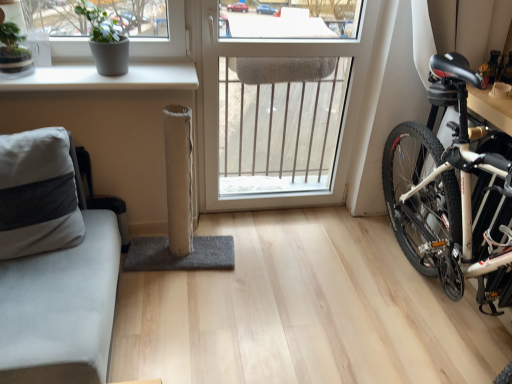
Question: Is gray matte pot at upper left smaller than white plastic window at center?

Choices:
 (A) yes
 (B) no

Answer: (A)

Question: From the image's perspective, is gray matte pot at upper left over white plastic window at center?

Choices:
 (A) no
 (B) yes

Answer: (B)

Question: Is gray matte pot at upper left in contact with white plastic window at center?

Choices:
 (A) yes
 (B) no

Answer: (B)

Question: Is gray matte pot at upper left at the right side of white plastic window at center?

Choices:
 (A) no
 (B) yes

Answer: (A)

Question: Does gray matte pot at upper left have a larger size compared to white plastic window at center?

Choices:
 (A) no
 (B) yes

Answer: (A)

Question: From the image's perspective, relative to white matte window sill at upper left, is white plastic window at center above or below?

Choices:
 (A) above
 (B) below

Answer: (B)

Question: From a real-world perspective, is white plastic window at center physically located above or below white matte window sill at upper left?

Choices:
 (A) below
 (B) above

Answer: (A)

Question: Based on their sizes in the image, would you say white plastic window at center is bigger or smaller than white matte window sill at upper left?

Choices:
 (A) small
 (B) big

Answer: (B)

Question: In the image, is white plastic window at center on the left side or the right side of white matte window sill at upper left?

Choices:
 (A) right
 (B) left

Answer: (A)

Question: Is point (309, 19) closer or farther from the camera than point (117, 54)?

Choices:
 (A) farther
 (B) closer

Answer: (A)

Question: Considering their positions, is white plastic window at center located in front of or behind gray matte pot at upper left?

Choices:
 (A) front
 (B) behind

Answer: (B)

Question: In terms of width, does white plastic window at center look wider or thinner when compared to gray matte pot at upper left?

Choices:
 (A) thin
 (B) wide

Answer: (A)

Question: Looking at the image, does white plastic window at center seem bigger or smaller compared to gray matte pot at upper left?

Choices:
 (A) small
 (B) big

Answer: (B)

Question: From the image's perspective, is gray matte pot at upper left above or below gray fabric couch at left?

Choices:
 (A) above
 (B) below

Answer: (A)

Question: Considering the relative positions of gray matte pot at upper left and gray fabric couch at left in the image provided, is gray matte pot at upper left to the left or to the right of gray fabric couch at left?

Choices:
 (A) left
 (B) right

Answer: (B)